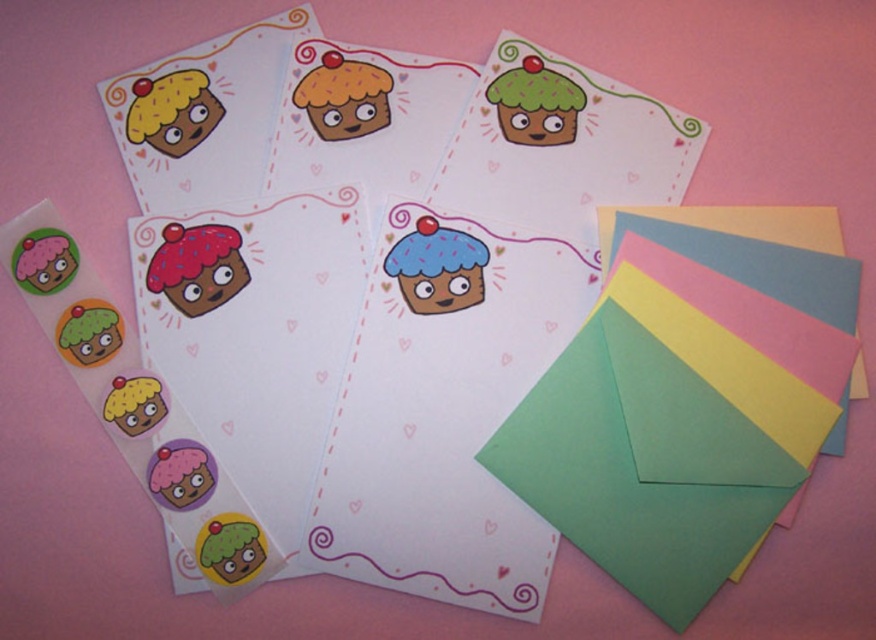
Question: Is matte pink cupcake at center smaller than matte yellow cupcake at upper left?

Choices:
 (A) yes
 (B) no

Answer: (A)

Question: Among these points, which one is farthest from the camera?

Choices:
 (A) (212, 273)
 (B) (556, 113)
 (C) (196, 483)

Answer: (B)

Question: In this image, where is green matte cupcake at upper right located relative to matte yellow cupcake at upper left?

Choices:
 (A) right
 (B) left

Answer: (A)

Question: Which object appears closest to the camera in this image?

Choices:
 (A) matte yellow cupcake at center
 (B) matte pink cupcake at center
 (C) green matte cupcake at upper right

Answer: (B)

Question: Does green matte cupcake at upper right have a larger size compared to pink glossy sticker at bottom left?

Choices:
 (A) yes
 (B) no

Answer: (A)

Question: Which is farther from the blue matte cupcake at center?

Choices:
 (A) matte pink cupcake at center
 (B) pink glossy sticker at bottom left
 (C) green matte cupcake at upper right
 (D) matte yellow cupcake at center

Answer: (B)